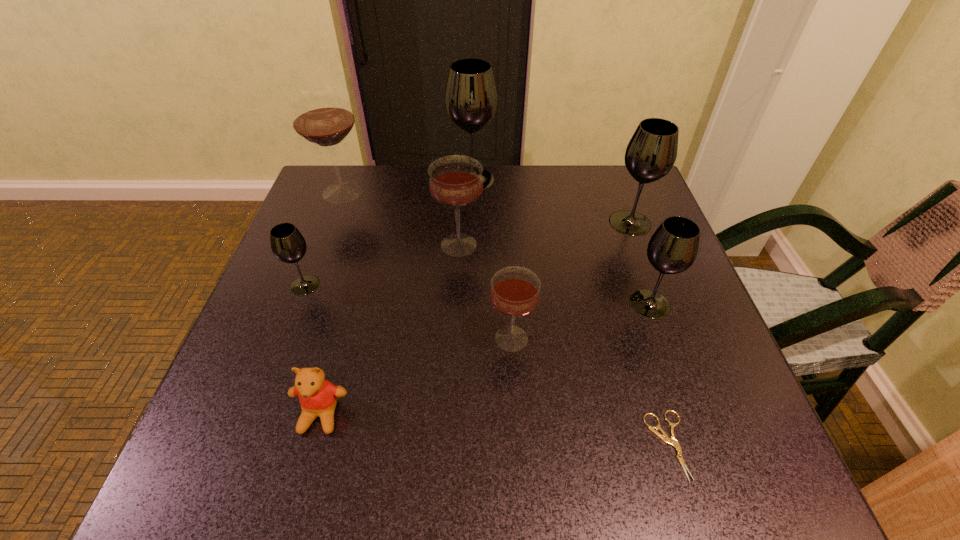
In order to click on wineglass that can be found as the fourth closest to the third biggest gray wineglass in this screenshot , I will do `click(471, 97)`.

This screenshot has height=540, width=960. I want to click on gray wineglass that stands as the third closest to the second smallest gray wineglass, so click(288, 245).

This screenshot has height=540, width=960. I want to click on gray wineglass that is the second closest to the shears, so click(x=651, y=153).

Identify the location of red wineglass that is the closest to the biggest red wineglass. (455, 182).

Locate an element on the screen. The image size is (960, 540). the closest red wineglass to the nearest red wineglass is located at coordinates (455, 182).

Where is `free space that satisfies the following two spatial constraints: 1. on the front-facing side of the shears; 2. on the left side of the red teddy bear`? The width and height of the screenshot is (960, 540). free space that satisfies the following two spatial constraints: 1. on the front-facing side of the shears; 2. on the left side of the red teddy bear is located at coordinates (313, 445).

This screenshot has width=960, height=540. I want to click on vacant region that satisfies the following two spatial constraints: 1. on the front side of the leftmost red wineglass; 2. on the left side of the shears, so click(250, 445).